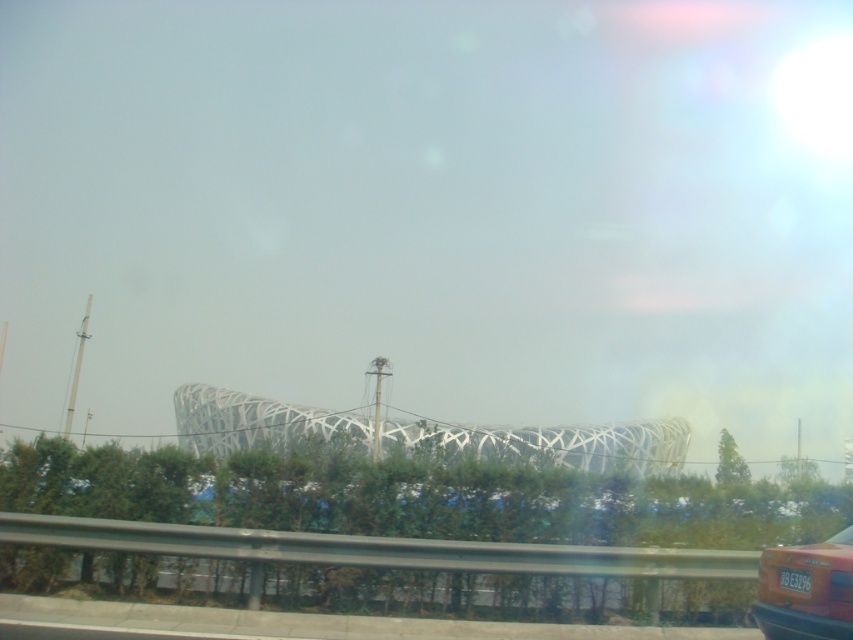
Question: Is matte red car at lower right to the left of transparent glass car window at lower right from the viewer's perspective?

Choices:
 (A) no
 (B) yes

Answer: (B)

Question: Is matte red car at lower right below white plastic license plate at lower right?

Choices:
 (A) no
 (B) yes

Answer: (B)

Question: Which of the following is the closest to the observer?

Choices:
 (A) matte red car at lower right
 (B) white plastic license plate at lower right

Answer: (A)

Question: Can you confirm if matte red car at lower right is positioned to the left of white plastic license plate at lower right?

Choices:
 (A) no
 (B) yes

Answer: (A)

Question: Among these objects, which one is nearest to the camera?

Choices:
 (A) transparent glass car window at lower right
 (B) matte red car at lower right
 (C) white plastic license plate at lower right

Answer: (B)

Question: Based on their relative distances, which object is farther from the transparent glass car window at lower right?

Choices:
 (A) matte red car at lower right
 (B) white plastic license plate at lower right

Answer: (B)